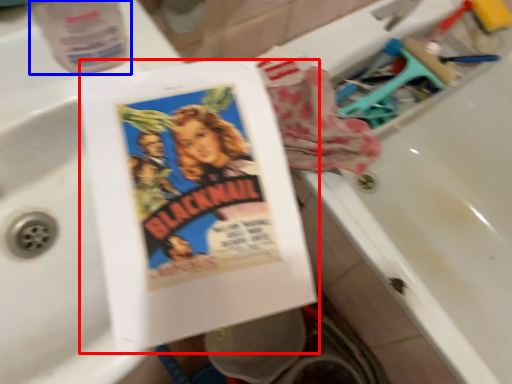
Question: Which object is further to the camera taking this photo, paperback book (highlighted by a red box) or bottle (highlighted by a blue box)?

Choices:
 (A) paperback book
 (B) bottle

Answer: (B)